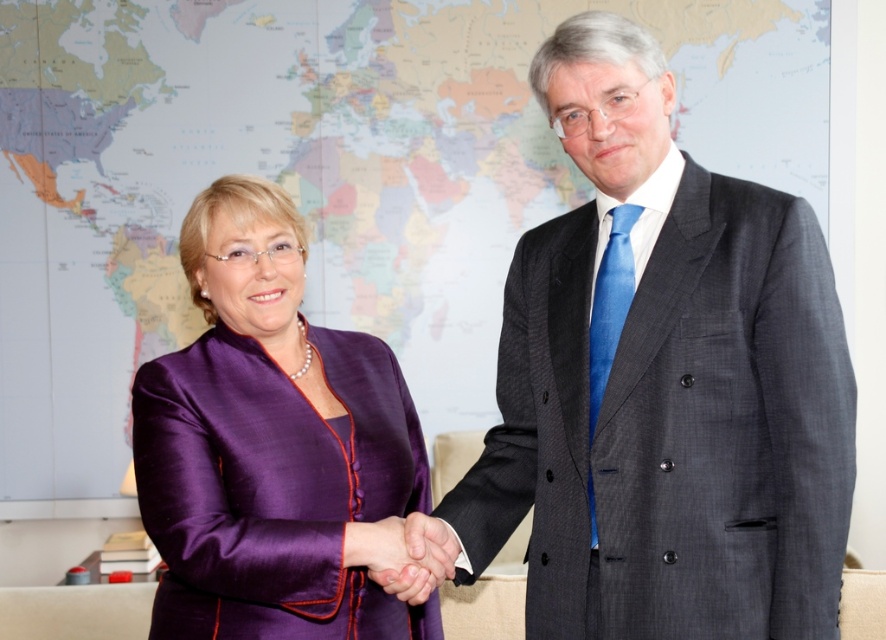
In the scene shown: Please provide the coordinates of the dark gray suit at center in the image. The coordinates should be in the format of a point with two decimal places, like this example format point 0.5,0.5. Please answer with the exact coordinates provided in the Objects Description.

The coordinates of the dark gray suit at center are point (x=662, y=381).

You are organizing a presentation and need to place a 2ft wide banner between the matte paper map at center and the purple silk dress at left. Given the spatial relationship between these two objects, can the banner fit horizontally between them?

The matte paper map at center is wider than the purple silk dress at left. Since the banner is 2ft wide, it can fit horizontally between them as the space between the two objects is sufficient to accommodate the banner.

You are organizing a photo shoot and need to ensure that the dark gray suit at center and the purple silk dress at left will fit within a rectangular backdrop that is 1.5 meters wide. Based on their sizes, will both items fit side by side without overlapping?

The dark gray suit at center is wider than the purple silk dress at left. However, since the exact widths are not provided, we cannot determine if they will fit side by side within the 1.5 meters backdrop. Additional measurements are needed.